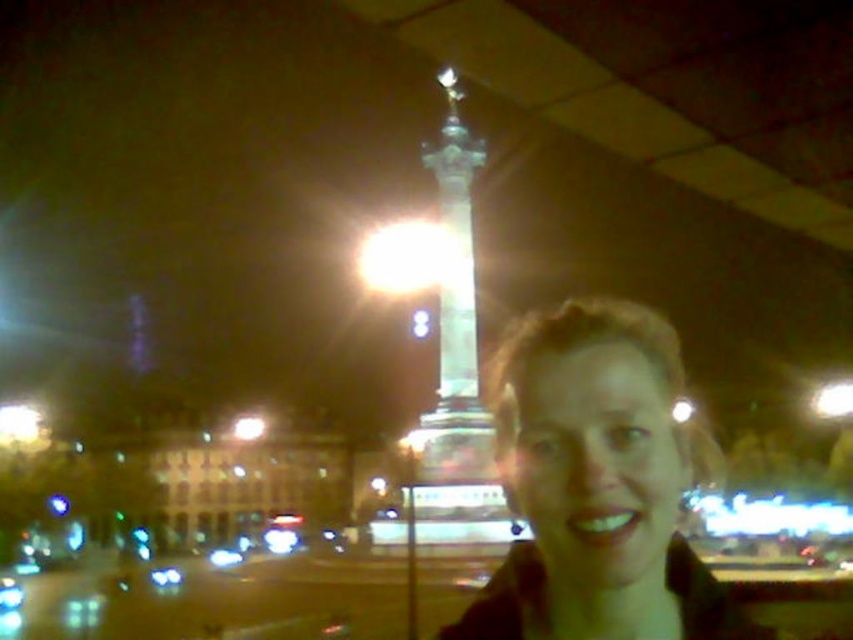
Looking at this image, between matte brown hair at center and shiny metallic column at center, which one appears on the right side from the viewer's perspective?

matte brown hair at center

Who is more distant from viewer, (x=686, y=433) or (x=479, y=465)?

Positioned behind is point (x=479, y=465).

Is point (640, 524) closer to camera compared to point (473, 304)?

Yes, point (640, 524) is in front of point (473, 304).

Identify the location of matte brown hair at center. (596, 484).